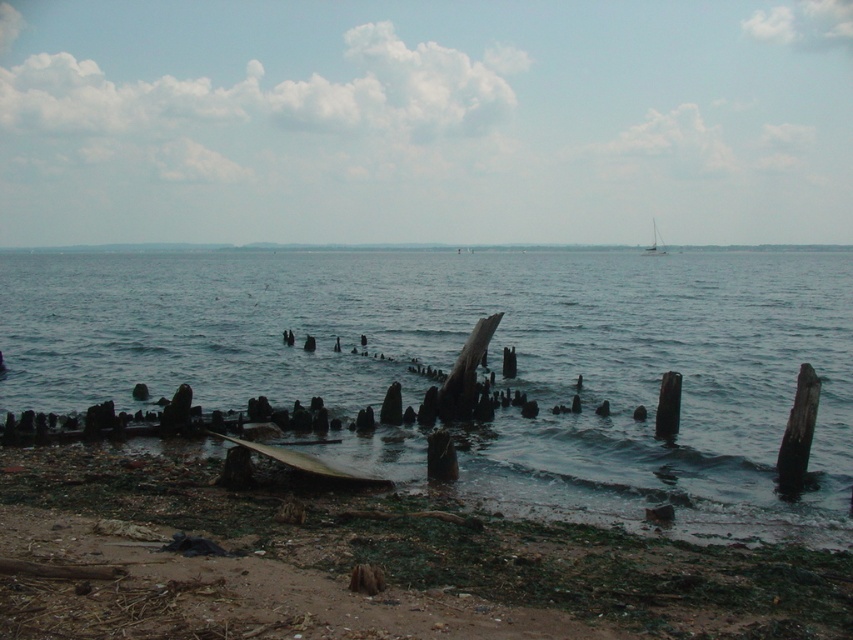
Question: Based on their relative distances, which object is farther from the blue water at center?

Choices:
 (A) brown dirt at lower left
 (B) white plastic sailboat at upper center

Answer: (B)

Question: Among these objects, which one is nearest to the camera?

Choices:
 (A) white plastic sailboat at upper center
 (B) blue water at center

Answer: (B)

Question: Can you confirm if brown dirt at lower left is positioned to the right of white plastic sailboat at upper center?

Choices:
 (A) no
 (B) yes

Answer: (A)

Question: Where is blue water at center located in relation to brown dirt at lower left in the image?

Choices:
 (A) below
 (B) above

Answer: (B)

Question: Can you confirm if brown dirt at lower left is bigger than white plastic sailboat at upper center?

Choices:
 (A) yes
 (B) no

Answer: (B)

Question: Which object is the closest to the brown dirt at lower left?

Choices:
 (A) blue water at center
 (B) white plastic sailboat at upper center

Answer: (A)